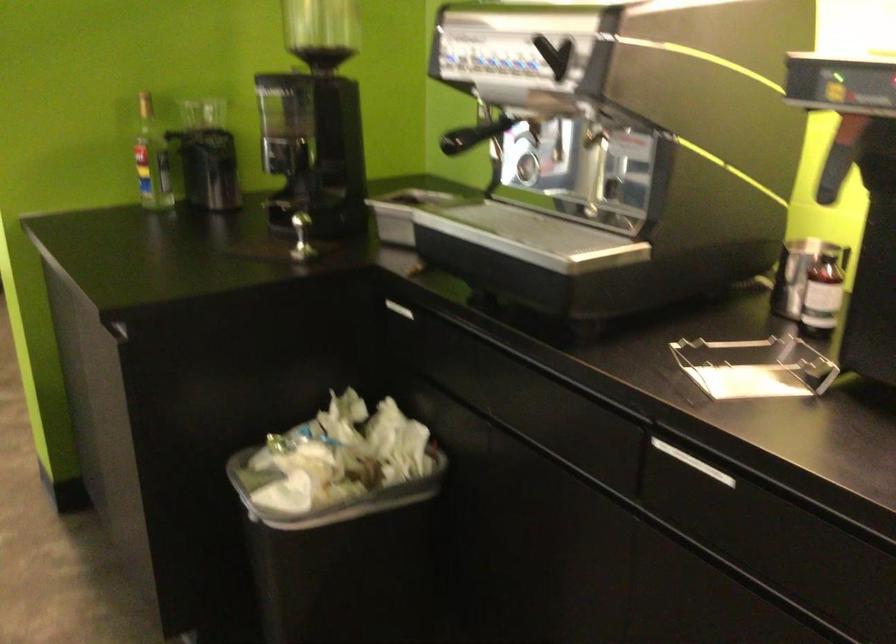
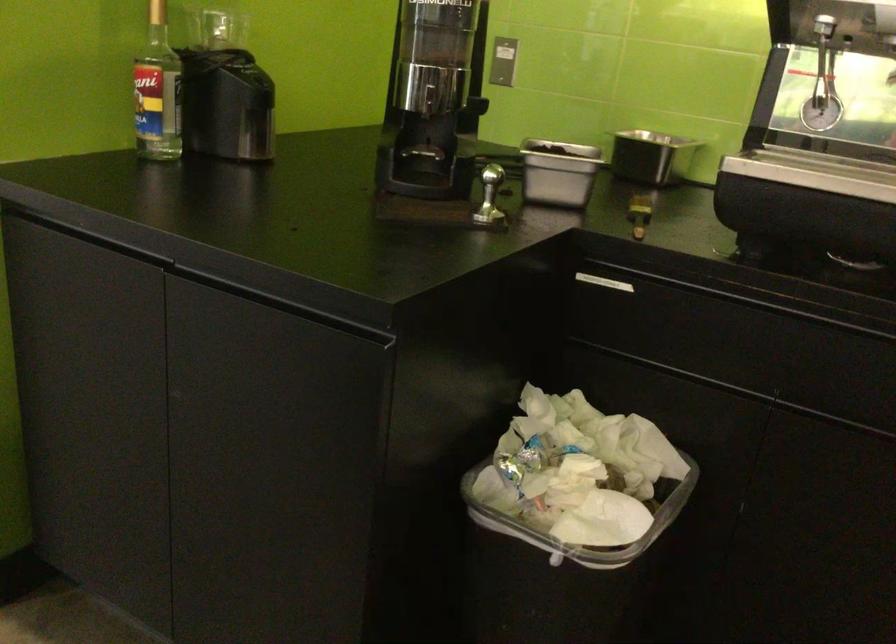
Locate, in the second image, the point that corresponds to the point at 282,489 in the first image.

(581, 524)